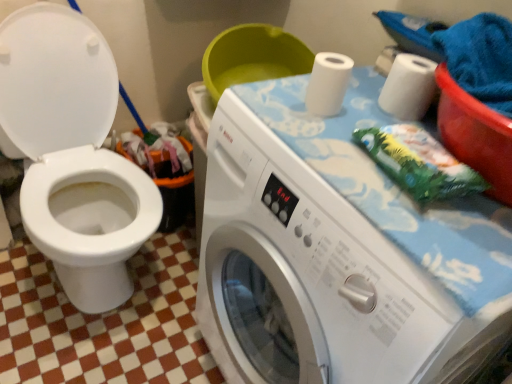
Question: Is white matte toilet paper at upper right, marked as the 2th toilet paper in a left-to-right arrangement, positioned with its back to white glossy toilet at left?

Choices:
 (A) no
 (B) yes

Answer: (A)

Question: From a real-world perspective, does white matte toilet paper at upper right, marked as the 2th toilet paper in a left-to-right arrangement, stand above white glossy toilet at left?

Choices:
 (A) no
 (B) yes

Answer: (B)

Question: Does white matte toilet paper at upper right, the first toilet paper from the right, come in front of white glossy toilet at left?

Choices:
 (A) no
 (B) yes

Answer: (A)

Question: Is white glossy toilet at left surrounded by white matte toilet paper at upper right, the first toilet paper from the right?

Choices:
 (A) no
 (B) yes

Answer: (A)

Question: Is white matte toilet paper at upper right, marked as the 2th toilet paper in a left-to-right arrangement, shorter than white glossy toilet at left?

Choices:
 (A) yes
 (B) no

Answer: (A)

Question: Would you consider white matte toilet paper at upper right, the first toilet paper from the right, to be distant from white glossy toilet at left?

Choices:
 (A) no
 (B) yes

Answer: (A)

Question: Does white plastic washing machine at center turn towards green fabric at upper right?

Choices:
 (A) yes
 (B) no

Answer: (B)

Question: Can we say white plastic washing machine at center lies outside green fabric at upper right?

Choices:
 (A) yes
 (B) no

Answer: (A)

Question: Would you say white plastic washing machine at center is a long distance from green fabric at upper right?

Choices:
 (A) yes
 (B) no

Answer: (B)

Question: Is white plastic washing machine at center positioned in front of green fabric at upper right?

Choices:
 (A) no
 (B) yes

Answer: (B)

Question: Considering the relative positions of white plastic washing machine at center and green fabric at upper right in the image provided, is white plastic washing machine at center behind green fabric at upper right?

Choices:
 (A) yes
 (B) no

Answer: (B)

Question: Can you confirm if white plastic washing machine at center is positioned to the left of green fabric at upper right?

Choices:
 (A) yes
 (B) no

Answer: (A)

Question: Can you confirm if white matte toilet paper at upper right, marked as the 2th toilet paper in a left-to-right arrangement, is shorter than orange plastic recycling bin at lower left?

Choices:
 (A) yes
 (B) no

Answer: (A)